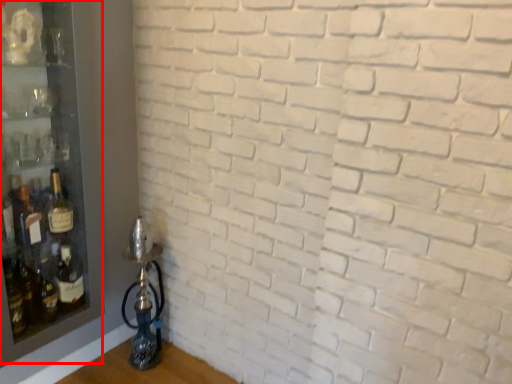
Question: From the image's perspective, where is shelf (annotated by the red box) located relative to bottle?

Choices:
 (A) above
 (B) below

Answer: (A)